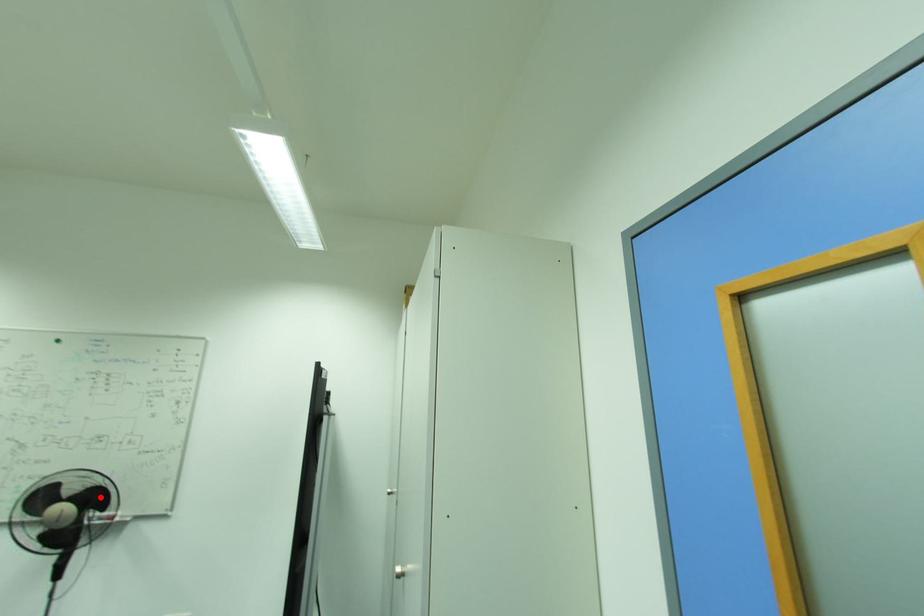
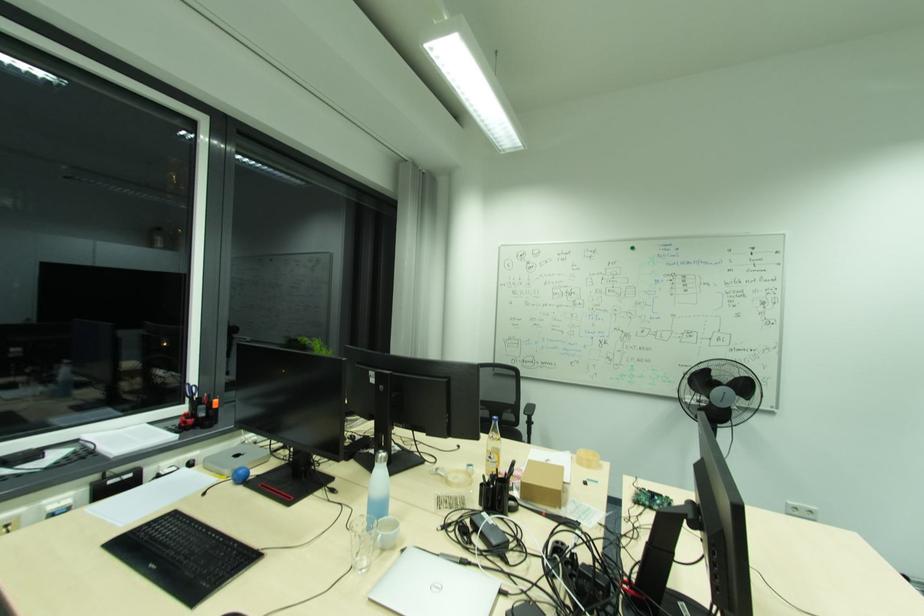
Question: I am providing you with two images of the same scene from different viewpoints. Given a red point in image1, look at the same physical point in image2. Is it:

Choices:
 (A) Closer to the viewpoint
 (B) Farther from the viewpoint

Answer: (B)